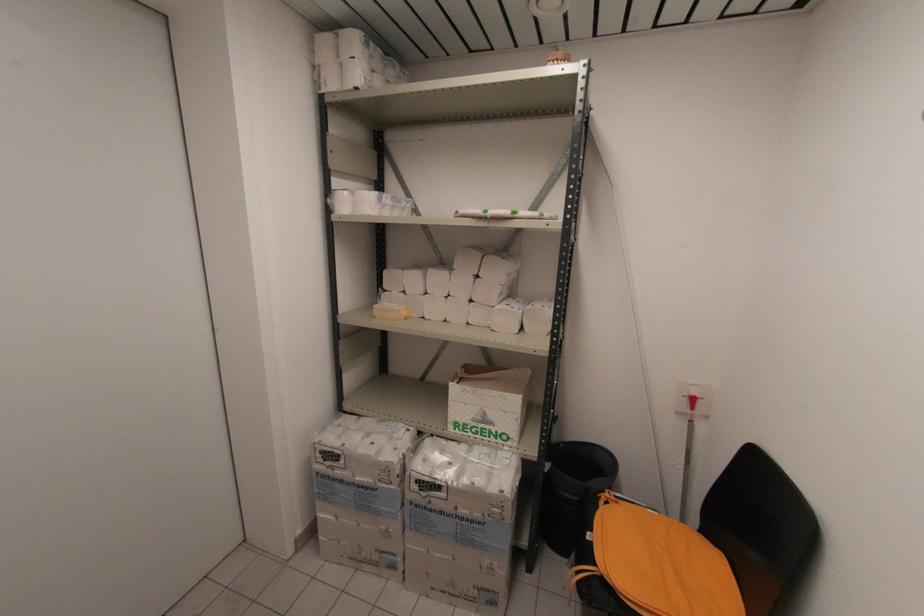
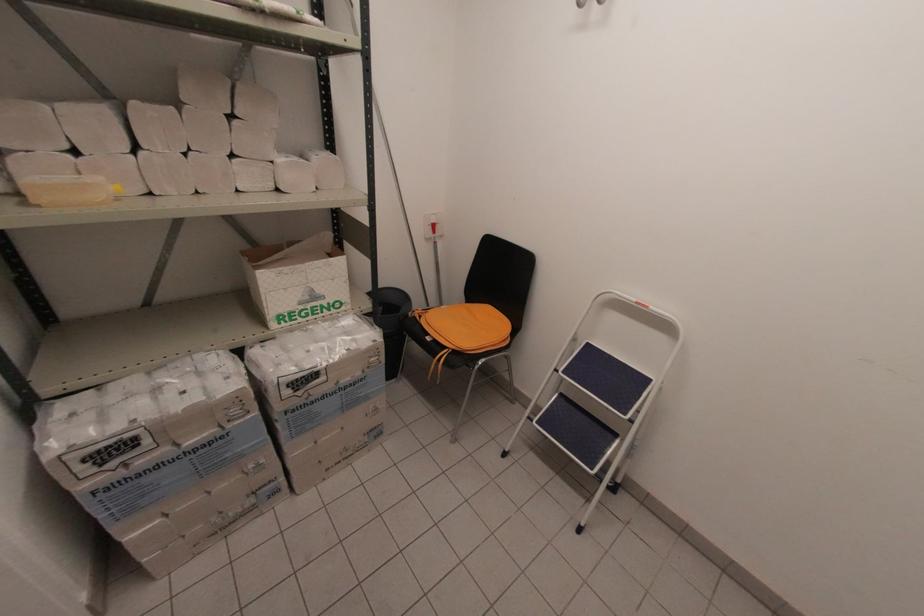
Where in the second image is the point corresponding to the point at 511,496 from the first image?

(383, 341)